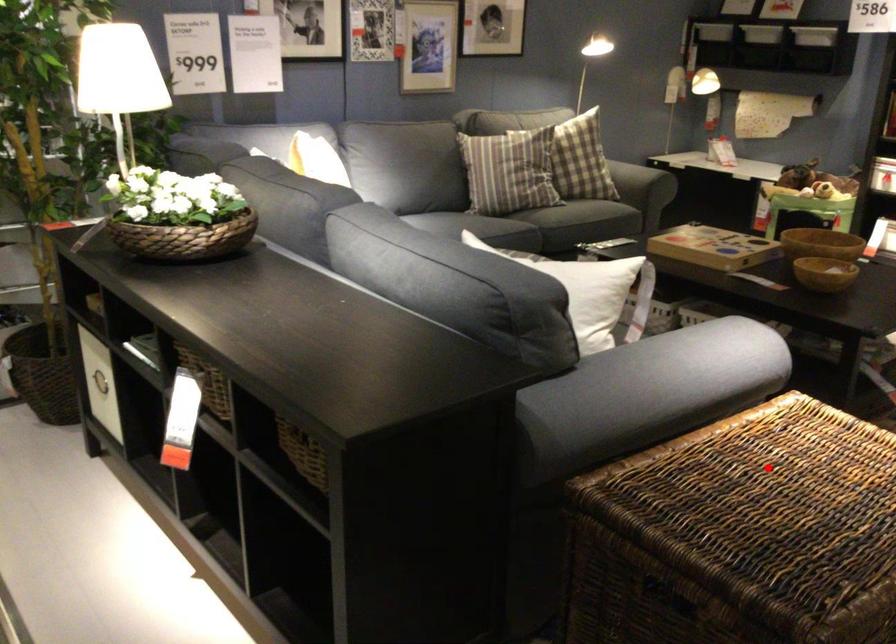
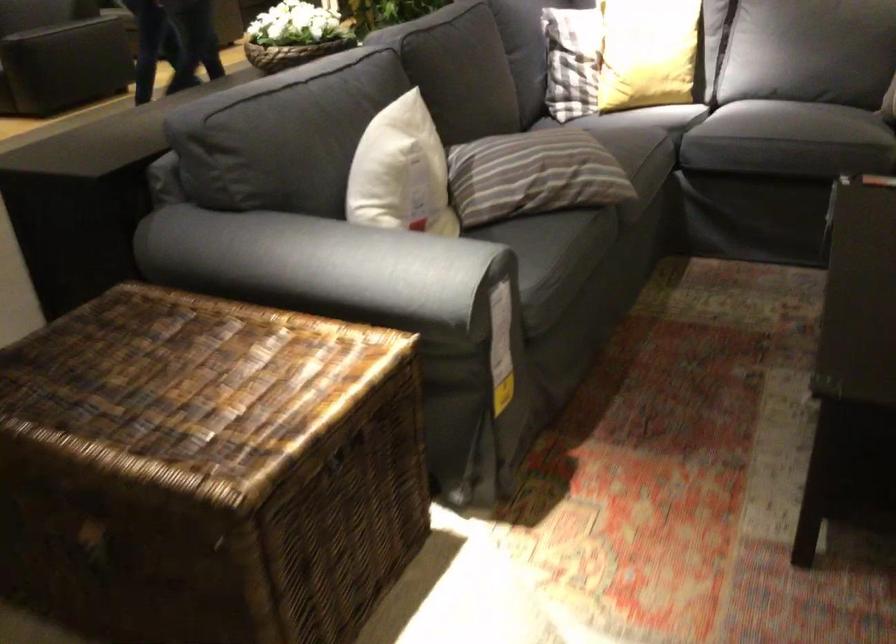
The point at the highlighted location is marked in the first image. Where is the corresponding point in the second image?

(195, 389)